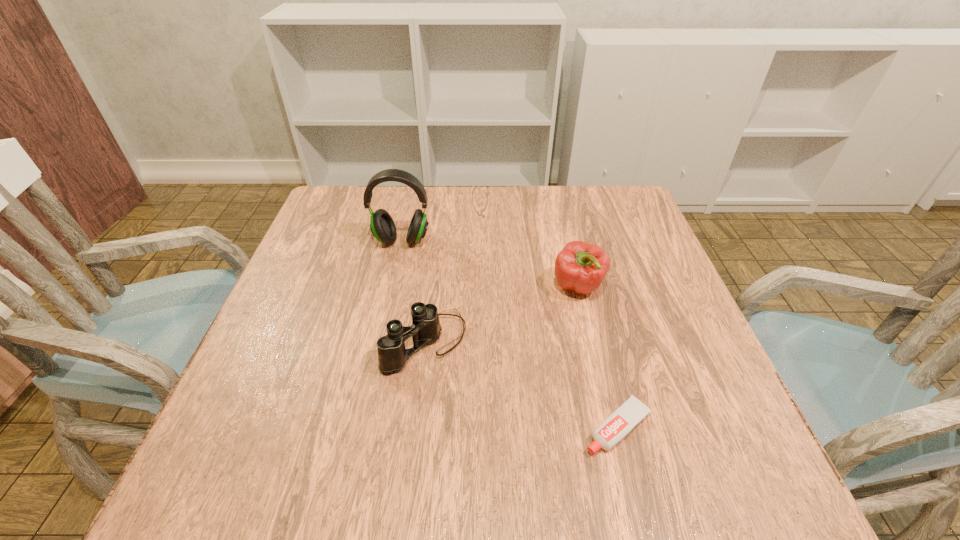
Locate an element on the screen. The width and height of the screenshot is (960, 540). headset is located at coordinates (382, 226).

Where is `the tallest object`? The width and height of the screenshot is (960, 540). the tallest object is located at coordinates (382, 226).

Identify the location of bell pepper. (580, 267).

The height and width of the screenshot is (540, 960). I want to click on the third nearest object, so click(x=580, y=267).

The width and height of the screenshot is (960, 540). What are the coordinates of `binoculars` in the screenshot? It's located at (392, 355).

Where is `the third farthest object`? The image size is (960, 540). the third farthest object is located at coordinates (392, 355).

In order to click on toothpaste in this screenshot , I will do `click(630, 413)`.

The image size is (960, 540). Find the location of `the nearest object`. the nearest object is located at coordinates (630, 413).

Where is `vacant space located 0.250m on the ear cups of the tallest object`? vacant space located 0.250m on the ear cups of the tallest object is located at coordinates (383, 327).

Locate an element on the screen. vacant area situated on the front of the bell pepper is located at coordinates (623, 472).